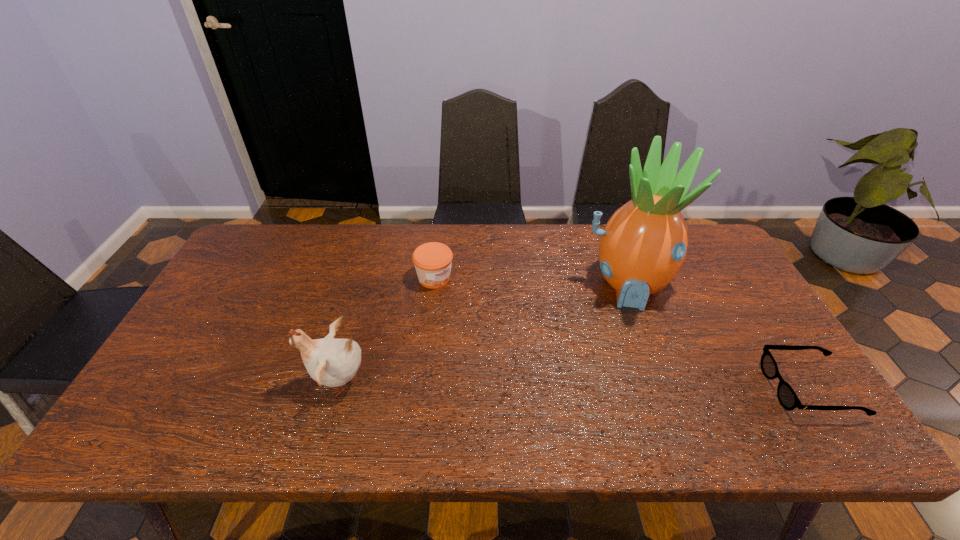
Find the location of `the third shortest object`. the third shortest object is located at coordinates (331, 362).

Locate an element on the screen. This screenshot has width=960, height=540. the leftmost object is located at coordinates (331, 362).

Where is `the rightmost object`? This screenshot has height=540, width=960. the rightmost object is located at coordinates (788, 399).

Locate an element on the screen. This screenshot has height=540, width=960. spectacles is located at coordinates (788, 399).

Locate an element on the screen. the second shortest object is located at coordinates (432, 260).

Where is `the second object from left to right`? The image size is (960, 540). the second object from left to right is located at coordinates (432, 260).

Find the location of a particular element. Image resolution: width=960 pixels, height=540 pixels. pineapple is located at coordinates (643, 246).

The width and height of the screenshot is (960, 540). I want to click on the second object from right to left, so click(x=643, y=246).

Locate an element on the screen. Image resolution: width=960 pixels, height=540 pixels. free space located 0.260m at the beak of the third shortest object is located at coordinates (200, 381).

The width and height of the screenshot is (960, 540). What are the coordinates of `free point located at the beak of the third shortest object` in the screenshot? It's located at click(x=265, y=381).